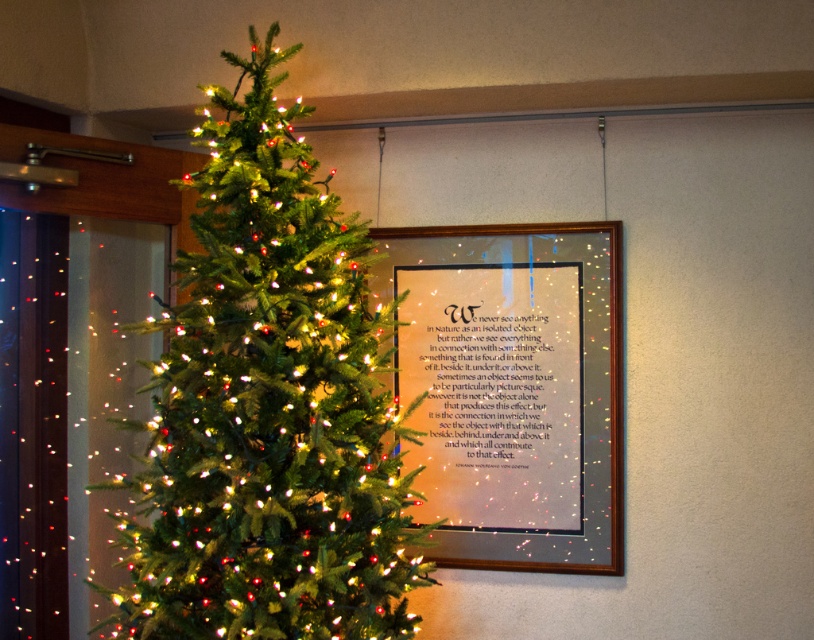
You are standing in front of the Christmas tree and want to reach a point that is 7.82 feet away from you. Is the point at coordinates point [383,600] within the area of the Christmas tree?

The point [383,600] is 7.82 feet away from the camera, so yes, it is within the area of the Christmas tree since the distance matches.

You are standing in the room where the green matte christmas tree at center is located. If you face the tree and turn 90 degrees to your left, which direction will you be facing?

Since the green matte christmas tree at center is positioned at point 0.636 on the x and 0.333 on the y axis, turning 90 degrees to your left would orient you towards the left side of the room relative to the tree.

You are hanging a new decoration on the wall. You see the green matte christmas tree at center and the matte silver frame at center. Which object is located higher up on the wall?

The green matte christmas tree at center is above the matte silver frame at center, so it is higher up on the wall.